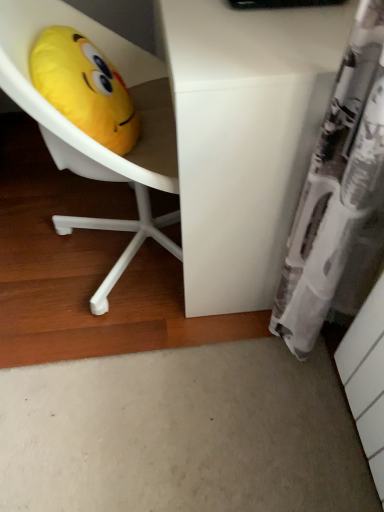
Question: From a real-world perspective, relative to yellow plush toy at upper left, is white matte desk at center vertically above or below?

Choices:
 (A) above
 (B) below

Answer: (B)

Question: From the image's perspective, is white matte desk at center located above or below yellow plush toy at upper left?

Choices:
 (A) below
 (B) above

Answer: (B)

Question: Considering the positions of white matte desk at center and yellow plush toy at upper left in the image, is white matte desk at center wider or thinner than yellow plush toy at upper left?

Choices:
 (A) wide
 (B) thin

Answer: (A)

Question: From the image's perspective, is yellow plush toy at upper left located above or below white matte desk at center?

Choices:
 (A) above
 (B) below

Answer: (B)

Question: In terms of size, does yellow plush toy at upper left appear bigger or smaller than white matte desk at center?

Choices:
 (A) small
 (B) big

Answer: (A)

Question: Is point [62, 88] closer or farther from the camera than point [273, 260]?

Choices:
 (A) closer
 (B) farther

Answer: (A)

Question: From a real-world perspective, relative to white matte desk at center, is yellow plush toy at upper left vertically above or below?

Choices:
 (A) below
 (B) above

Answer: (B)